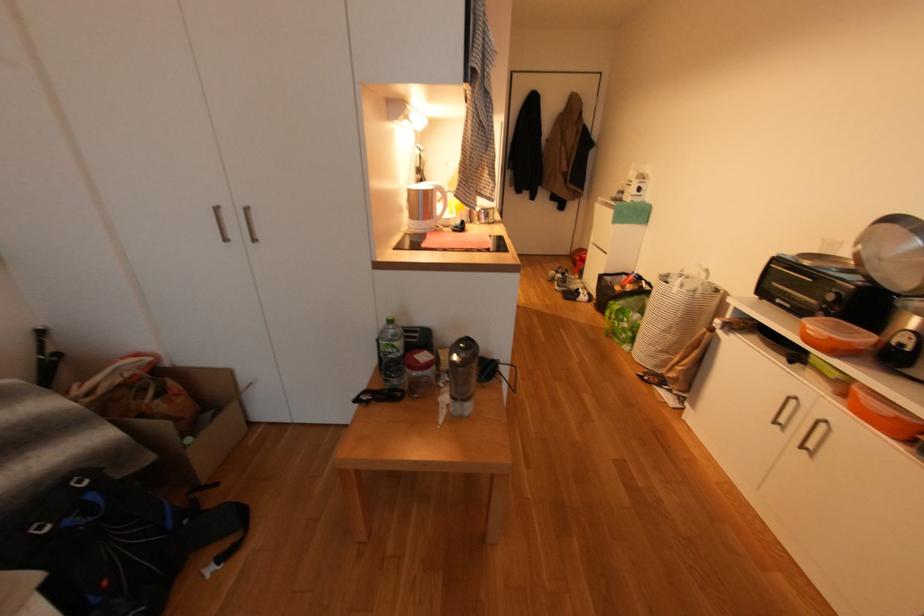
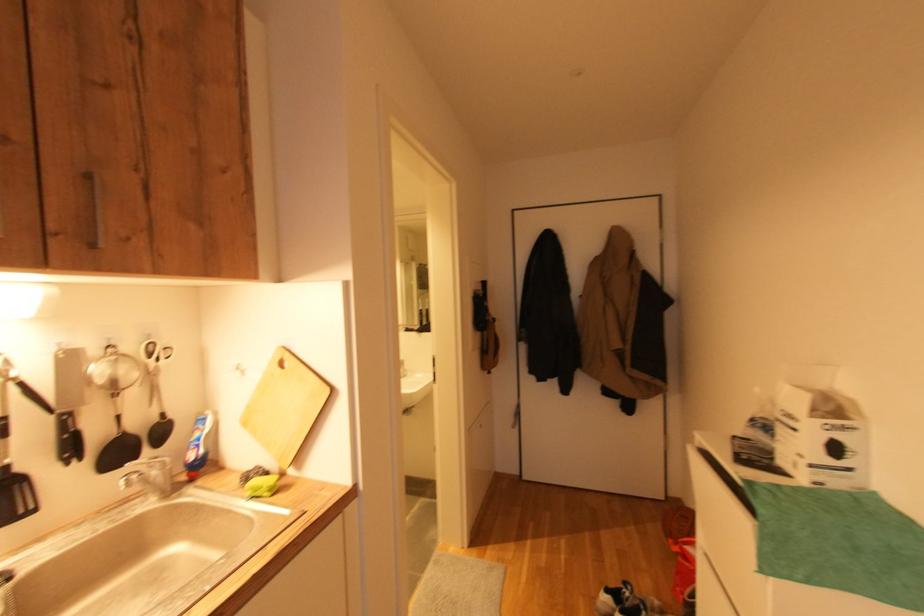
The images are taken continuously from a first-person perspective. In which direction are you moving?

→ The movement direction of the cameraman is right, forward.